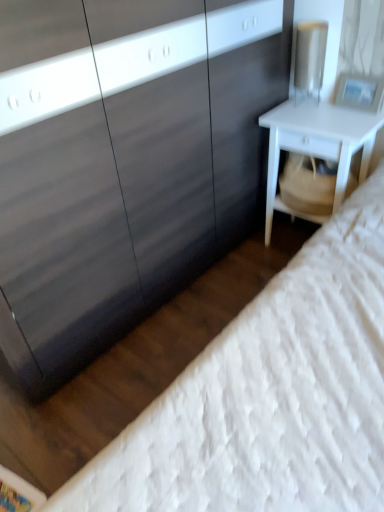
You are a GUI agent. You are given a task and a screenshot of the screen. Output one action in this format:
    pyautogui.click(x=<x>, y=<y>)
    Task: Click on the vacant area on top of white matte nightstand at right (from a real-world perspective)
    
    Given the screenshot: What is the action you would take?
    pyautogui.click(x=315, y=121)